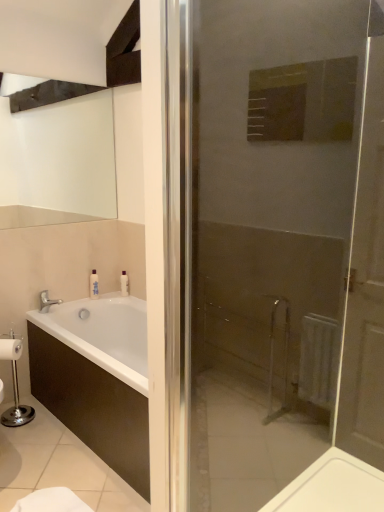
Question: Do you think white wooden door at center is within silver metallic faucet at lower left, or outside of it?

Choices:
 (A) inside
 (B) outside

Answer: (B)

Question: In terms of height, does white wooden door at center look taller or shorter compared to silver metallic faucet at lower left?

Choices:
 (A) short
 (B) tall

Answer: (B)

Question: Estimate the real-world distances between objects in this image. Which object is closer to the white wooden door at center?

Choices:
 (A) silver metallic faucet at lower left
 (B) white glossy bottle at upper left

Answer: (B)

Question: Which is nearer to the white glossy bottle at upper left?

Choices:
 (A) white wooden door at center
 (B) silver metallic faucet at lower left

Answer: (B)